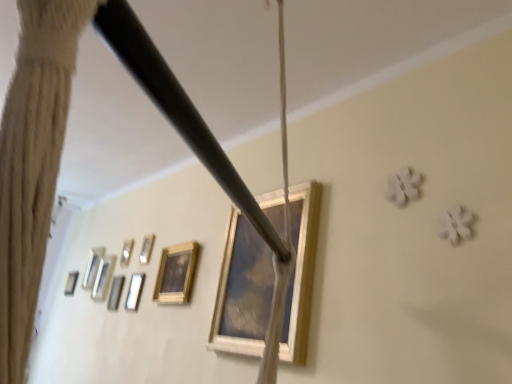
Describe the element at coordinates (92, 267) in the screenshot. I see `metallic silver picture frame at upper left, which is counted as the 6th picture frame, starting from the front` at that location.

The image size is (512, 384). What do you see at coordinates (126, 253) in the screenshot?
I see `metallic silver picture frame at upper left, which is the third picture frame from right to left` at bounding box center [126, 253].

This screenshot has height=384, width=512. In order to click on wooden picture frame at left, which is the 1th picture frame from back to front in this screenshot , I will do `click(71, 283)`.

What is the approximate height of wooden picture frame at lower left, which is counted as the 6th picture frame, starting from the left?

It is 12.93 inches.

Describe the element at coordinates (115, 292) in the screenshot. I see `metallic silver picture frame at upper left, the fourth picture frame from the right` at that location.

This screenshot has width=512, height=384. What do you see at coordinates (103, 278) in the screenshot?
I see `wooden picture frame at left, the third picture frame positioned from the back` at bounding box center [103, 278].

Locate an element on the screen. This screenshot has height=384, width=512. wooden picture frame at left, which is the third picture frame in left-to-right order is located at coordinates (103, 278).

Find the location of a particular element. The image size is (512, 384). metallic silver picture frame at upper left, which appears as the 2th picture frame when viewed from the back is located at coordinates (92, 267).

Which of these two, wooden picture frame at left, which is the 1th picture frame in left-to-right order, or wooden picture frame at center, the seventh picture frame when ordered from back to front, is thinner?

With smaller width is wooden picture frame at left, which is the 1th picture frame in left-to-right order.

This screenshot has width=512, height=384. There is a wooden picture frame at left, which is the 1th picture frame in left-to-right order. In order to click on the 1st picture frame above it (from a real-world perspective) in this screenshot , I will do `click(242, 291)`.

Could you measure the distance between wooden picture frame at left, arranged as the 7th picture frame when viewed from the right, and wooden picture frame at center, the seventh picture frame when ordered from back to front?

7.98 feet.

Which is closer to the camera, (66, 285) or (220, 306)?

Clearly, point (66, 285) is more distant from the camera than point (220, 306).

Is wooden picture frame at left, which is counted as the fifth picture frame, starting from the front, oriented towards metallic silver picture frame at upper left, the fourth picture frame positioned from the front?

No, wooden picture frame at left, which is counted as the fifth picture frame, starting from the front, does not turn towards metallic silver picture frame at upper left, the fourth picture frame positioned from the front.

Between wooden picture frame at left, acting as the fifth picture frame starting from the right, and metallic silver picture frame at upper left, placed as the 5th picture frame when sorted from left to right, which one appears on the left side from the viewer's perspective?

Positioned to the left is wooden picture frame at left, acting as the fifth picture frame starting from the right.

From the wooden picture frame at left, the third picture frame positioned from the back, count 2nd picture frame to the right and point to it. Please provide its 2D coordinates.

[(126, 253)]

How many degrees apart are the facing directions of wooden picture frame at left, which is the third picture frame in left-to-right order, and metallic silver picture frame at upper left, which is the third picture frame from right to left?

wooden picture frame at left, which is the third picture frame in left-to-right order, and metallic silver picture frame at upper left, which is the third picture frame from right to left, are facing 0.00382 degrees away from each other.

Could you tell me if metallic silver picture frame at upper left, which appears as the 2th picture frame when viewed from the back, is turned towards metallic silver picture frame at upper left, the fourth picture frame positioned from the front?

No, metallic silver picture frame at upper left, which appears as the 2th picture frame when viewed from the back, is not oriented towards metallic silver picture frame at upper left, the fourth picture frame positioned from the front.

Does metallic silver picture frame at upper left, the sixth picture frame when ordered from right to left, touch metallic silver picture frame at upper left, placed as the 4th picture frame when sorted from back to front?

No, metallic silver picture frame at upper left, the sixth picture frame when ordered from right to left, is not with metallic silver picture frame at upper left, placed as the 4th picture frame when sorted from back to front.

From the image's perspective, count 2nd picture frames downward from the metallic silver picture frame at upper left, placed as the 4th picture frame when sorted from back to front, and point to it. Please provide its 2D coordinates.

[(92, 267)]

Is metallic silver picture frame at upper left, placed as the 5th picture frame when sorted from left to right, not near wooden picture frame at center, which is counted as the first picture frame, starting from the front?

Indeed, metallic silver picture frame at upper left, placed as the 5th picture frame when sorted from left to right, is not near wooden picture frame at center, which is counted as the first picture frame, starting from the front.

From the image's perspective, relative to wooden picture frame at center, which is counted as the first picture frame, starting from the front, is metallic silver picture frame at upper left, placed as the 4th picture frame when sorted from back to front, above or below?

metallic silver picture frame at upper left, placed as the 4th picture frame when sorted from back to front, is below wooden picture frame at center, which is counted as the first picture frame, starting from the front.

Is metallic silver picture frame at upper left, which is the third picture frame from right to left, facing away from wooden picture frame at center, the seventh picture frame when ordered from back to front?

No, wooden picture frame at center, the seventh picture frame when ordered from back to front, is not at the back of metallic silver picture frame at upper left, which is the third picture frame from right to left.

Between metallic silver picture frame at upper left, which is the third picture frame from right to left, and wooden picture frame at center, the seventh picture frame when ordered from back to front, which one appears on the left side from the viewer's perspective?

Positioned to the left is metallic silver picture frame at upper left, which is the third picture frame from right to left.

Does wooden picture frame at left, which is the third picture frame in left-to-right order, appear on the right side of wooden picture frame at left, arranged as the 7th picture frame when viewed from the right?

Yes.

From a real-world perspective, is wooden picture frame at left, acting as the fifth picture frame starting from the right, below wooden picture frame at left, which is the 1th picture frame from back to front?

Actually, wooden picture frame at left, acting as the fifth picture frame starting from the right, is physically above wooden picture frame at left, which is the 1th picture frame from back to front, in the real world.

Is wooden picture frame at left, which is counted as the fifth picture frame, starting from the front, positioned with its back to wooden picture frame at left, which appears as the seventh picture frame when viewed from the front?

No, wooden picture frame at left, which is counted as the fifth picture frame, starting from the front, is not facing away from wooden picture frame at left, which appears as the seventh picture frame when viewed from the front.

Consider the image. Is wooden picture frame at left, acting as the fifth picture frame starting from the right, at the back of wooden picture frame at left, which appears as the seventh picture frame when viewed from the front?

wooden picture frame at left, which appears as the seventh picture frame when viewed from the front, is not turned away from wooden picture frame at left, acting as the fifth picture frame starting from the right.

How different are the orientations of wooden picture frame at left, which is the 1th picture frame in left-to-right order, and wooden picture frame at left, which is counted as the fifth picture frame, starting from the front, in degrees?

The facing directions of wooden picture frame at left, which is the 1th picture frame in left-to-right order, and wooden picture frame at left, which is counted as the fifth picture frame, starting from the front, are 0.919 degrees apart.

How far apart are wooden picture frame at left, arranged as the 7th picture frame when viewed from the right, and wooden picture frame at left, which is the third picture frame in left-to-right order?

63.35 centimeters.

Considering their positions, is wooden picture frame at left, which is the 1th picture frame in left-to-right order, located in front of or behind wooden picture frame at left, which is counted as the fifth picture frame, starting from the front?

In the image, wooden picture frame at left, which is the 1th picture frame in left-to-right order, appears behind wooden picture frame at left, which is counted as the fifth picture frame, starting from the front.

Looking at this image, is there a large distance between metallic silver picture frame at upper left, which is the third picture frame from right to left, and wooden picture frame at left, arranged as the 7th picture frame when viewed from the right?

No, metallic silver picture frame at upper left, which is the third picture frame from right to left, is in close proximity to wooden picture frame at left, arranged as the 7th picture frame when viewed from the right.

Looking at this image, is metallic silver picture frame at upper left, the fourth picture frame positioned from the front, wider or thinner than wooden picture frame at left, arranged as the 7th picture frame when viewed from the right?

In the image, metallic silver picture frame at upper left, the fourth picture frame positioned from the front, appears to be more narrow than wooden picture frame at left, arranged as the 7th picture frame when viewed from the right.

Based on the photo, which of these two, metallic silver picture frame at upper left, placed as the 5th picture frame when sorted from left to right, or wooden picture frame at left, which appears as the seventh picture frame when viewed from the front, stands shorter?

With less height is metallic silver picture frame at upper left, placed as the 5th picture frame when sorted from left to right.

Considering the relative positions of metallic silver picture frame at upper left, placed as the 5th picture frame when sorted from left to right, and wooden picture frame at left, which is the 1th picture frame in left-to-right order, in the image provided, is metallic silver picture frame at upper left, placed as the 5th picture frame when sorted from left to right, to the left of wooden picture frame at left, which is the 1th picture frame in left-to-right order, from the viewer's perspective?

Incorrect, metallic silver picture frame at upper left, placed as the 5th picture frame when sorted from left to right, is not on the left side of wooden picture frame at left, which is the 1th picture frame in left-to-right order.

You are a GUI agent. You are given a task and a screenshot of the screen. Output one action in this format:
    pyautogui.click(x=<x>, y=<y>)
    Task: Click on the 1st picture frame located beneath the wooden picture frame at center, the seventh picture frame when ordered from back to front (from a real-world perspective)
    
    Given the screenshot: What is the action you would take?
    pyautogui.click(x=71, y=283)

At what (x,y) coordinates should I click in order to perform the action: click on the 2nd picture frame counting from the right of the wooden picture frame at left, which is the third picture frame in left-to-right order. Please return your answer as a coordinate pair (x, y). The width and height of the screenshot is (512, 384). Looking at the image, I should click on (126, 253).

Considering their positions, is metallic silver picture frame at upper left, which is counted as the third picture frame, starting from the front, positioned further to wooden picture frame at left, which is the 1th picture frame from back to front, than metallic silver picture frame at upper left, the fourth picture frame positioned from the front?

Based on the image, metallic silver picture frame at upper left, the fourth picture frame positioned from the front, appears to be further to wooden picture frame at left, which is the 1th picture frame from back to front.

Estimate the real-world distances between objects in this image. Which object is further from metallic silver picture frame at upper left, marked as the 4th picture frame in a left-to-right arrangement, wooden picture frame at left, arranged as the 7th picture frame when viewed from the right, or wooden picture frame at left, the third picture frame positioned from the back?

The object further to metallic silver picture frame at upper left, marked as the 4th picture frame in a left-to-right arrangement, is wooden picture frame at left, arranged as the 7th picture frame when viewed from the right.

Based on their spatial positions, is wooden picture frame at center, the seventh picture frame positioned from the left, or metallic silver picture frame at upper left, which is counted as the third picture frame, starting from the front, closer to wooden picture frame at lower left, which is counted as the 6th picture frame, starting from the left?

wooden picture frame at center, the seventh picture frame positioned from the left.

Estimate the real-world distances between objects in this image. Which object is closer to metallic silver picture frame at upper left, which is the third picture frame from right to left, metallic silver picture frame at upper left, which is counted as the third picture frame, starting from the front, or wooden picture frame at left, which is the 1th picture frame from back to front?

metallic silver picture frame at upper left, which is counted as the third picture frame, starting from the front.

From the image, which object appears to be farther from metallic silver picture frame at upper left, which is counted as the second picture frame, starting from the left, wooden picture frame at center, the 1th picture frame in the right-to-left sequence, or wooden picture frame at left, which is counted as the fifth picture frame, starting from the front?

The object further to metallic silver picture frame at upper left, which is counted as the second picture frame, starting from the left, is wooden picture frame at center, the 1th picture frame in the right-to-left sequence.

Looking at this image, estimate the real-world distances between objects in this image. Which object is further from wooden picture frame at left, which is the third picture frame in left-to-right order, wooden picture frame at left, which is the 1th picture frame in left-to-right order, or metallic silver picture frame at upper left, marked as the 4th picture frame in a left-to-right arrangement?

wooden picture frame at left, which is the 1th picture frame in left-to-right order, is positioned further to the anchor wooden picture frame at left, which is the third picture frame in left-to-right order.

Looking at the image, which one is located closer to wooden picture frame at left, arranged as the 7th picture frame when viewed from the right, metallic silver picture frame at upper left, placed as the 5th picture frame when sorted from left to right, or wooden picture frame at center, the seventh picture frame positioned from the left?

Based on the image, metallic silver picture frame at upper left, placed as the 5th picture frame when sorted from left to right, appears to be nearer to wooden picture frame at left, arranged as the 7th picture frame when viewed from the right.

Looking at the image, which one is located closer to wooden picture frame at center, the seventh picture frame positioned from the left, metallic silver picture frame at upper left, marked as the 4th picture frame in a left-to-right arrangement, or wooden picture frame at left, which is counted as the fifth picture frame, starting from the front?

The object closer to wooden picture frame at center, the seventh picture frame positioned from the left, is metallic silver picture frame at upper left, marked as the 4th picture frame in a left-to-right arrangement.

You are a GUI agent. You are given a task and a screenshot of the screen. Output one action in this format:
    pyautogui.click(x=<x>, y=<y>)
    Task: Click on the picture frame between wooden picture frame at lower left, which appears as the 2th picture frame when viewed from the front, and metallic silver picture frame at upper left, the fourth picture frame positioned from the front, in the front-back direction
    Image resolution: width=512 pixels, height=384 pixels.
    Given the screenshot: What is the action you would take?
    pyautogui.click(x=115, y=292)

Find the location of a particular element. picture frame between wooden picture frame at center, the seventh picture frame when ordered from back to front, and metallic silver picture frame at upper left, the fourth picture frame from the right, along the z-axis is located at coordinates tap(176, 273).

This screenshot has height=384, width=512. What are the coordinates of `picture frame positioned between wooden picture frame at left, which is counted as the fifth picture frame, starting from the front, and wooden picture frame at left, which appears as the seventh picture frame when viewed from the front, from near to far` in the screenshot? It's located at (92, 267).